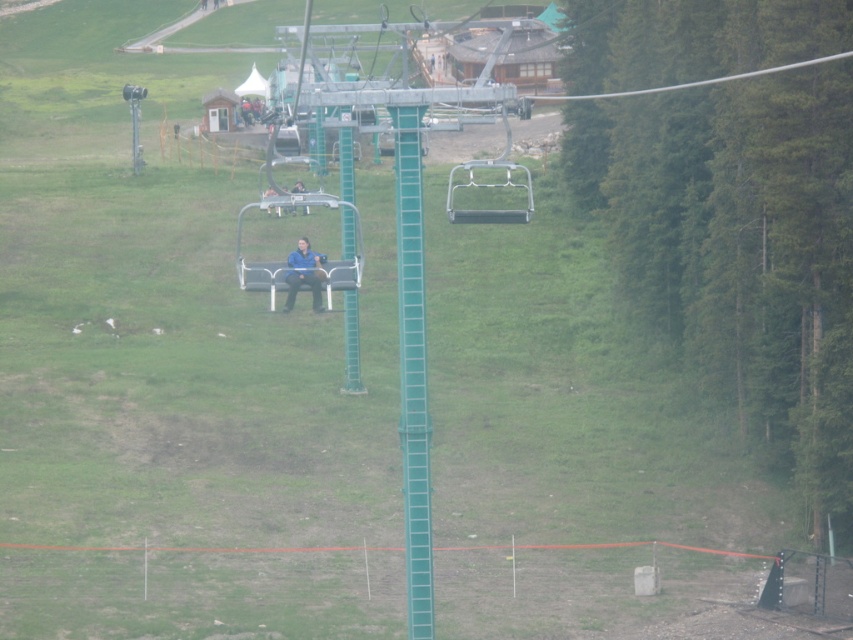
You are a visitor standing at the base of the chairlift and want to board the green plastic chair at center. As you look up, you notice a blue fabric jacket at center. Which object is positioned to the right from your perspective?

The green plastic chair at center is to the right of the blue fabric jacket at center, so the green plastic chair at center is positioned to the right from your perspective.

You are a maintenance worker checking the chairlift. You notice the green plastic chair at center and the blue fabric jacket at center. Which object is taller?

The green plastic chair at center is much taller than the blue fabric jacket at center.